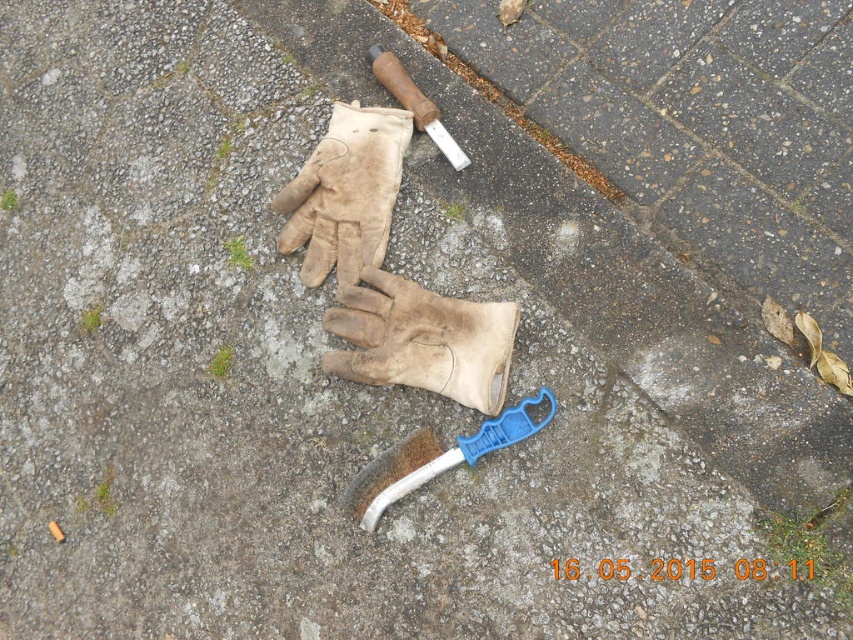
Does leather at center have a smaller size compared to wooden handle knife at upper center?

Incorrect, leather at center is not smaller in size than wooden handle knife at upper center.

Image resolution: width=853 pixels, height=640 pixels. Identify the location of leather at center. (422, 340).

From the picture: Can you confirm if blue plastic shovel at center is smaller than wooden handle knife at upper center?

Yes, blue plastic shovel at center is smaller than wooden handle knife at upper center.

Is blue plastic shovel at center thinner than wooden handle knife at upper center?

In fact, blue plastic shovel at center might be wider than wooden handle knife at upper center.

Which is in front, point (543, 420) or point (462, 150)?

Point (543, 420)

Locate an element on the screen. Image resolution: width=853 pixels, height=640 pixels. blue plastic shovel at center is located at coordinates (438, 458).

Based on the photo, is leather at center below blue plastic shovel at center?

Actually, leather at center is above blue plastic shovel at center.

The height and width of the screenshot is (640, 853). Identify the location of leather at center. (422, 340).

Identify the location of leather at center. (422, 340).